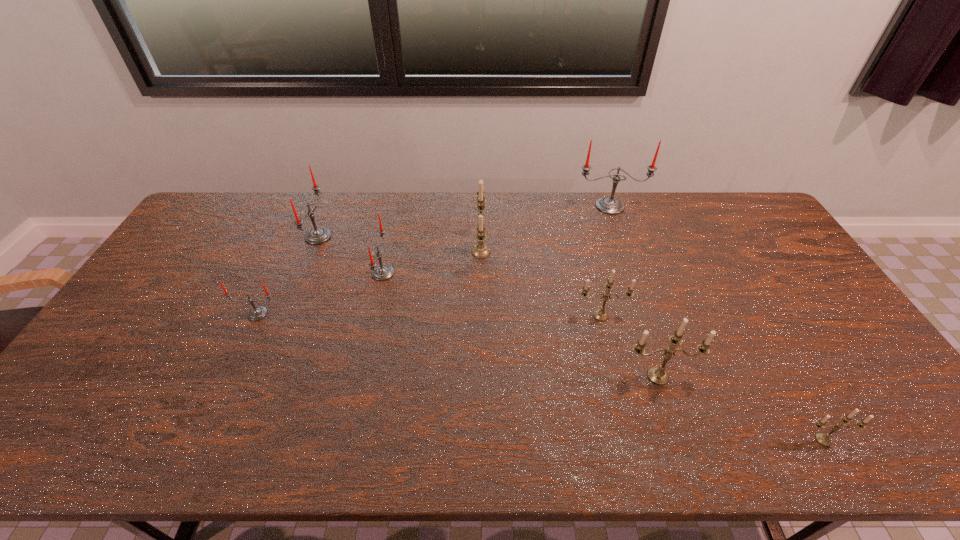
Locate which candle ranks sixth in proximity to the fourth object from left to right. Please provide its 2D coordinates. Your answer should be formatted as a tuple, i.e. [(x, y)], where the tuple contains the x and y coordinates of a point satisfying the conditions above.

[(257, 313)]

Select which candle is the fourth closest to the second smallest metallic candle. Please provide its 2D coordinates. Your answer should be formatted as a tuple, i.e. [(x, y)], where the tuple contains the x and y coordinates of a point satisfying the conditions above.

[(609, 205)]

Identify which red candle is the second closest to the third smallest red candle. Please provide its 2D coordinates. Your answer should be formatted as a tuple, i.e. [(x, y)], where the tuple contains the x and y coordinates of a point satisfying the conditions above.

[(257, 313)]

Where is `red candle identified as the third closest to the second farthest metallic candle`? Image resolution: width=960 pixels, height=540 pixels. red candle identified as the third closest to the second farthest metallic candle is located at coordinates (318, 235).

Where is `metallic candle that is the second closest to the fourth candle from left to right`? metallic candle that is the second closest to the fourth candle from left to right is located at coordinates (657, 375).

Identify which metallic candle is the third nearest to the seventh farthest object. Please provide its 2D coordinates. Your answer should be formatted as a tuple, i.e. [(x, y)], where the tuple contains the x and y coordinates of a point satisfying the conditions above.

[(480, 250)]

Identify the location of vacant space that satisfies the following two spatial constraints: 1. on the front-facing side of the second nearest object; 2. on the left side of the third biggest red candle. (360, 376).

Find the location of `free space that satisfies the following two spatial constraints: 1. on the front side of the rightmost metallic candle; 2. on the left side of the second smallest metallic candle`. free space that satisfies the following two spatial constraints: 1. on the front side of the rightmost metallic candle; 2. on the left side of the second smallest metallic candle is located at coordinates (633, 440).

Where is `vacant space that satisfies the following two spatial constraints: 1. on the front-facing side of the rightmost candle; 2. on the left side of the smallest red candle`? vacant space that satisfies the following two spatial constraints: 1. on the front-facing side of the rightmost candle; 2. on the left side of the smallest red candle is located at coordinates (199, 440).

This screenshot has width=960, height=540. I want to click on free point that satisfies the following two spatial constraints: 1. on the front-facing side of the second nearest metallic candle; 2. on the right side of the third smallest red candle, so click(x=262, y=376).